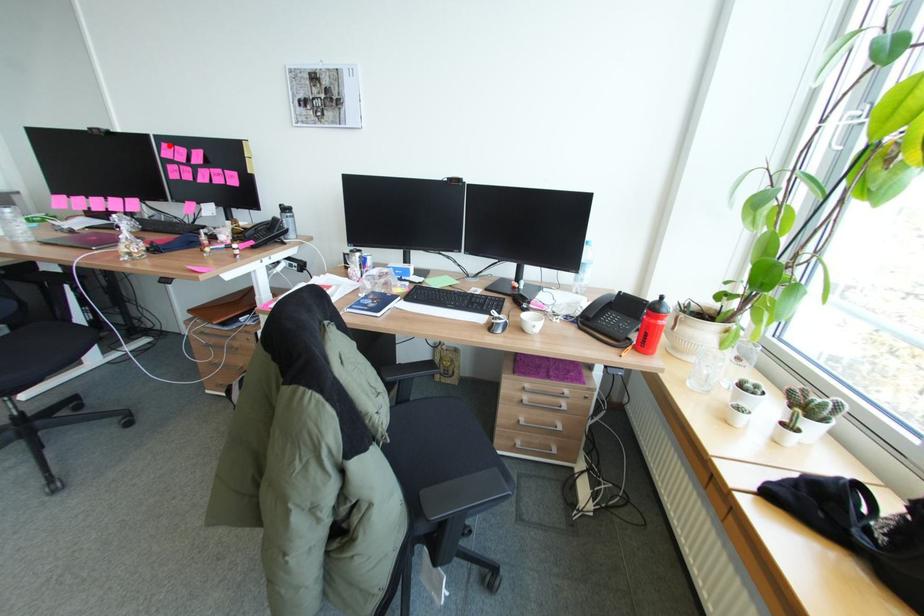
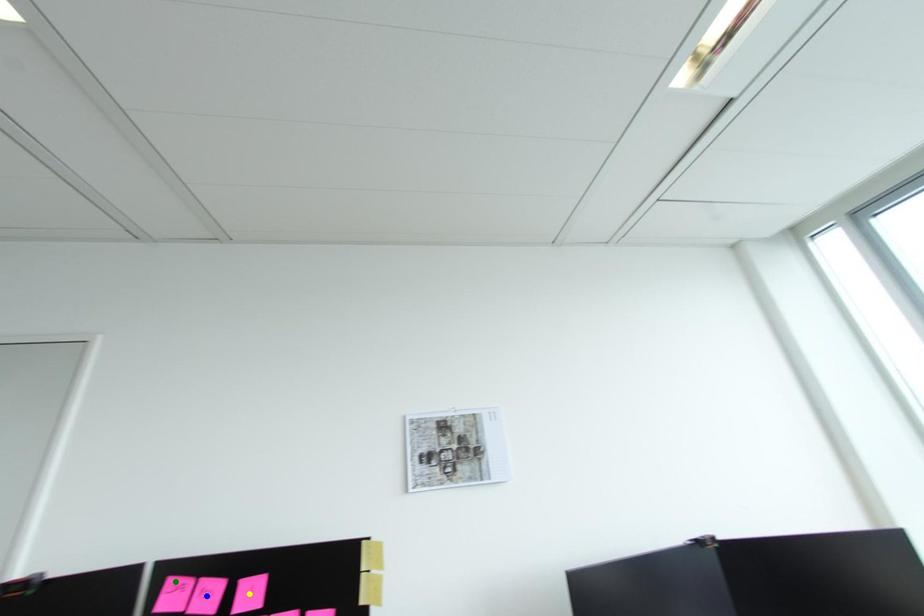
Question: I am providing you with two images of the same scene from different viewpoints. A red point is marked on the first image. You are given multiple points on the second image. Which point in image 2 represents the same 3d spot as the red point in image 1?

Choices:
 (A) blue point
 (B) green point
 (C) yellow point

Answer: (B)